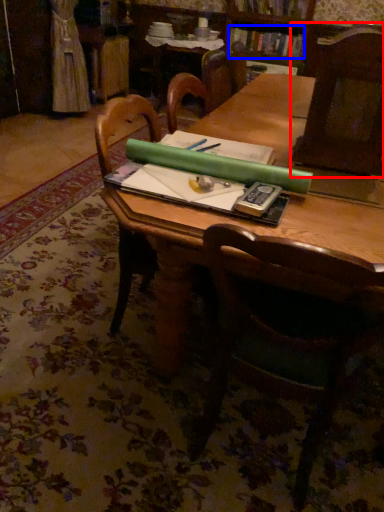
Question: Which object is closer to the camera taking this photo, chair (highlighted by a red box) or book (highlighted by a blue box)?

Choices:
 (A) chair
 (B) book

Answer: (A)